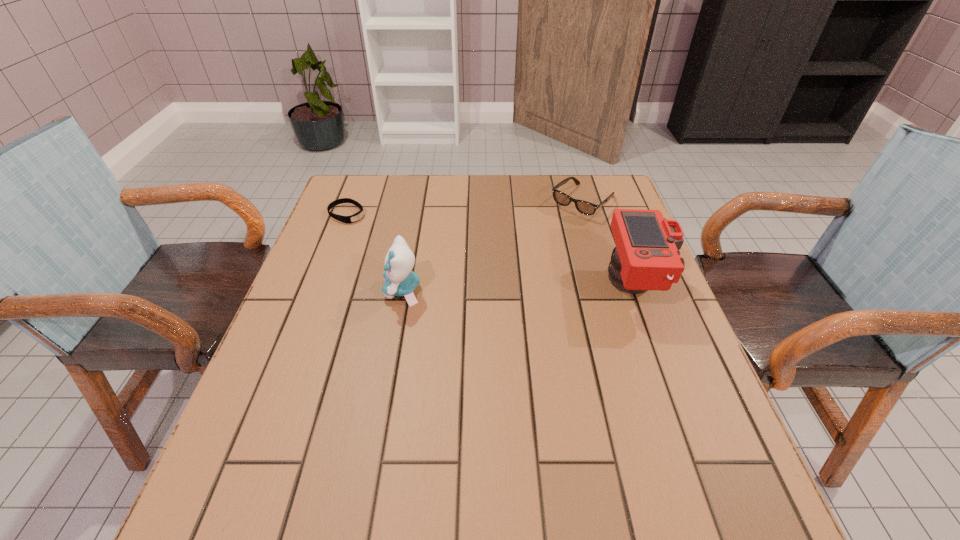
Locate an element on the screen. The width and height of the screenshot is (960, 540). vacant space that satisfies the following two spatial constraints: 1. on the front side of the kitten; 2. on the face of the shortest object is located at coordinates [x=318, y=291].